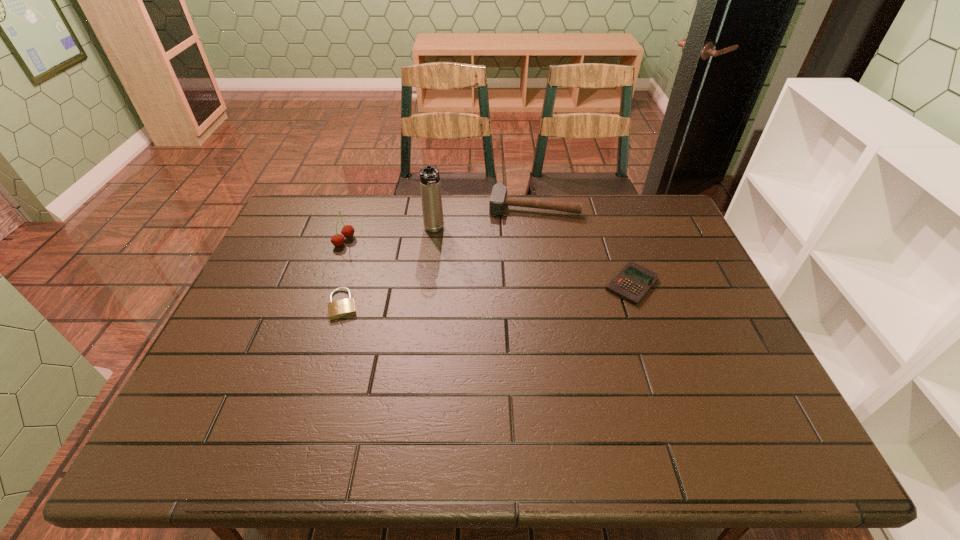
Identify the location of free spot on the desktop that is between the shortest object and the second shortest object and is positioned on the surface of the fourth shortest object. (480, 295).

Identify the location of vacant space on the desktop that is between the shortest object and the rightmost object and is positioned on the handle side of the thermos bottle. Image resolution: width=960 pixels, height=540 pixels. (449, 297).

Identify the location of free space on the desktop that is between the padlock and the calculator and is positioned on the striking surface of the hammer. The image size is (960, 540). (522, 292).